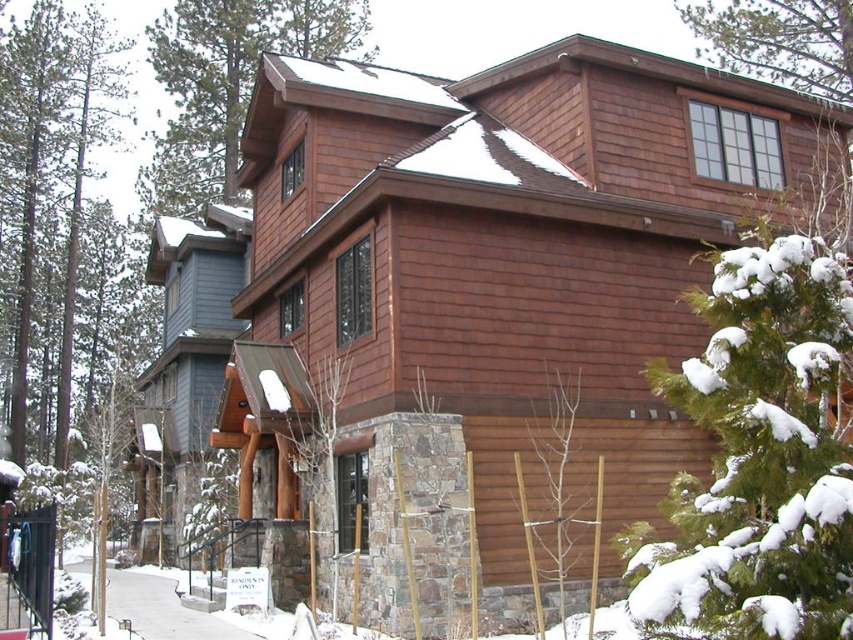
You are standing on the front porch of the two story house and want to see the green textured pine tree at upper right. Which direction should you look to see it without any obstruction from the bare wood tree at center?

The green textured pine tree at upper right is positioned over the bare wood tree at center, so you should look upward to see it without obstruction from the bare wood tree at center.

You are standing in front of the house and notice a point marked at coordinates (48, 193). What object does this point correspond to?

The point at coordinates (48, 193) corresponds to the green coniferous tree at left.